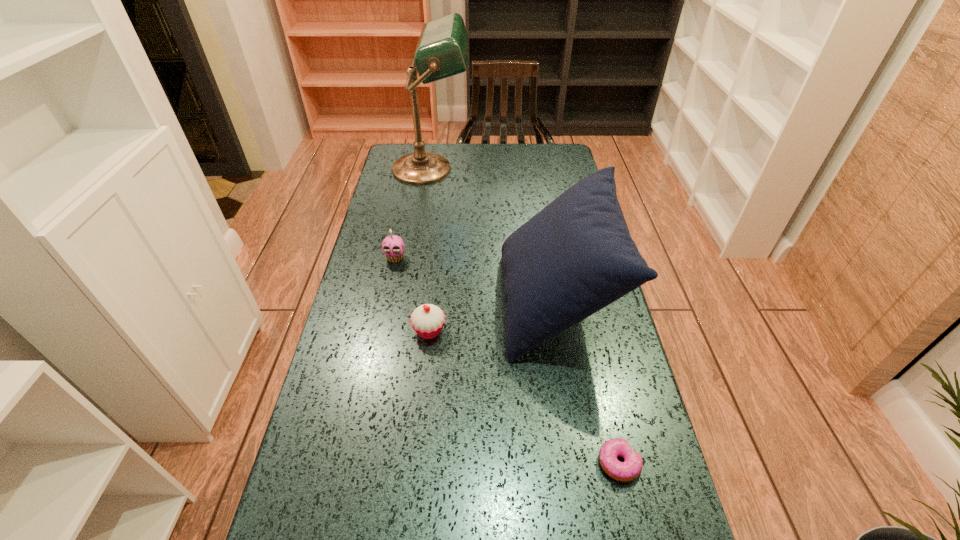
Choose which object is the fourth nearest neighbor to the right cupcake. Please provide its 2D coordinates. Your answer should be formatted as a tuple, i.e. [(x, y)], where the tuple contains the x and y coordinates of a point satisfying the conditions above.

[(442, 49)]

What are the coordinates of `object that is the second closest to the second tallest object` in the screenshot? It's located at (631, 468).

You are a GUI agent. You are given a task and a screenshot of the screen. Output one action in this format:
    pyautogui.click(x=<x>, y=<y>)
    Task: Click on the cupcake that is the closest one to the nearest object
    This screenshot has width=960, height=540.
    Given the screenshot: What is the action you would take?
    pyautogui.click(x=427, y=320)

You are a GUI agent. You are given a task and a screenshot of the screen. Output one action in this format:
    pyautogui.click(x=<x>, y=<y>)
    Task: Click on the cupcake object that ranks as the closest to the cushion
    This screenshot has height=540, width=960.
    Given the screenshot: What is the action you would take?
    pyautogui.click(x=427, y=320)

This screenshot has height=540, width=960. What are the coordinates of `blank space that satisfies the following two spatial constraints: 1. on the facing side of the nearest object; 2. on the left side of the second tallest object` in the screenshot? It's located at (582, 463).

You are a GUI agent. You are given a task and a screenshot of the screen. Output one action in this format:
    pyautogui.click(x=<x>, y=<y>)
    Task: Click on the vacant space that satisfies the following two spatial constraints: 1. on the face of the right cupcake; 2. on the left side of the third tallest object
    The width and height of the screenshot is (960, 540).
    Given the screenshot: What is the action you would take?
    pyautogui.click(x=380, y=331)

Locate an element on the screen. The width and height of the screenshot is (960, 540). free space in the image that satisfies the following two spatial constraints: 1. on the facing side of the cushion; 2. on the front side of the shorter cupcake is located at coordinates point(560,331).

This screenshot has width=960, height=540. I want to click on free region that satisfies the following two spatial constraints: 1. above the green lampshade of the farthest object; 2. on the right side of the right cupcake, so click(406, 331).

Locate an element on the screen. The width and height of the screenshot is (960, 540). vacant point that satisfies the following two spatial constraints: 1. above the green lampshade of the second shortest object; 2. on the right side of the tallest object is located at coordinates (406, 331).

You are a GUI agent. You are given a task and a screenshot of the screen. Output one action in this format:
    pyautogui.click(x=<x>, y=<y>)
    Task: Click on the vacant region that satisfies the following two spatial constraints: 1. above the green lampshade of the second shortest object; 2. on the left side of the table lamp
    Image resolution: width=960 pixels, height=540 pixels.
    Given the screenshot: What is the action you would take?
    pyautogui.click(x=406, y=331)